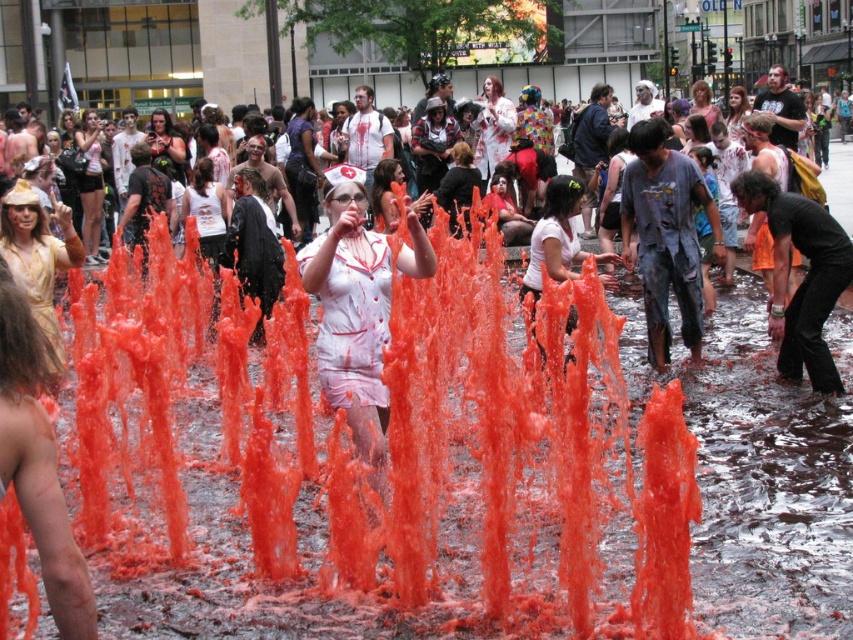
Question: Is translucent orange liquid at center above gold textured dress at left?

Choices:
 (A) yes
 (B) no

Answer: (B)

Question: Considering the real-world distances, which object is farthest from the blonde hair at center?

Choices:
 (A) translucent orange liquid at center
 (B) white matte nurse hat at center
 (C) white matte nurse outfit at center
 (D) gold textured dress at left

Answer: (A)

Question: Is white matte nurse hat at center to the left of blonde hair at center from the viewer's perspective?

Choices:
 (A) no
 (B) yes

Answer: (B)

Question: Which of the following is the farthest from the observer?

Choices:
 (A) matte white nurse hat at center
 (B) matte white nurse hat at upper left
 (C) white matte nurse outfit at center

Answer: (B)

Question: Among these objects, which one is farthest from the camera?

Choices:
 (A) matte white nurse hat at center
 (B) white matte nurse hat at center
 (C) translucent orange liquid at center

Answer: (A)

Question: Is white matte nurse uniform at center further to camera compared to matte white nurse hat at center?

Choices:
 (A) yes
 (B) no

Answer: (A)